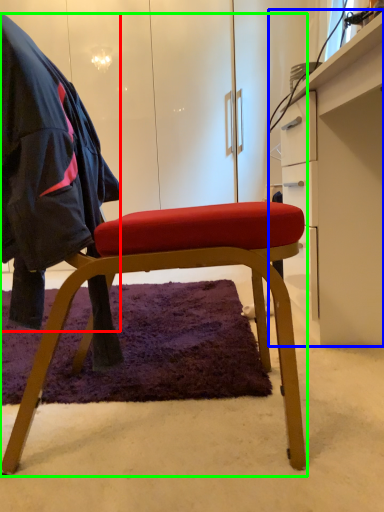
Question: Which object is positioned farthest from cloak (highlighted by a red box)? Select from desk (highlighted by a blue box) and chair (highlighted by a green box).

Choices:
 (A) desk
 (B) chair

Answer: (A)